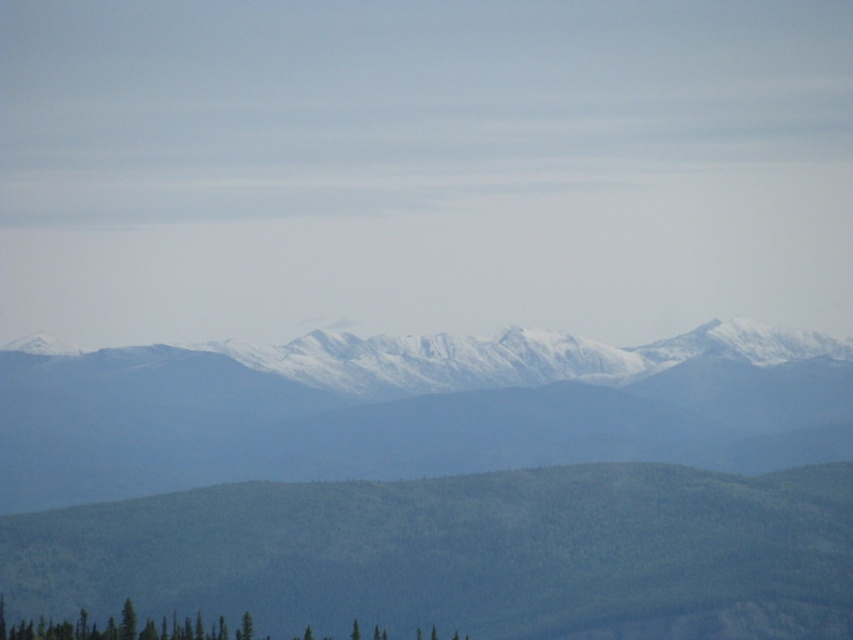
Question: Which object appears closest to the camera in this image?

Choices:
 (A) green textured trees at lower left
 (B) snowy mountain range at center

Answer: (B)

Question: Which of the following is the farthest from the observer?

Choices:
 (A) snowy mountain range at center
 (B) green textured trees at lower left

Answer: (B)

Question: Which point appears farthest from the camera in this image?

Choices:
 (A) (67, 465)
 (B) (224, 632)

Answer: (B)

Question: Can you confirm if snowy mountain range at center is positioned to the right of green textured trees at lower left?

Choices:
 (A) yes
 (B) no

Answer: (A)

Question: Considering the relative positions of snowy mountain range at center and green textured trees at lower left in the image provided, where is snowy mountain range at center located with respect to green textured trees at lower left?

Choices:
 (A) below
 (B) above

Answer: (B)

Question: Is snowy mountain range at center positioned in front of green textured trees at lower left?

Choices:
 (A) no
 (B) yes

Answer: (B)